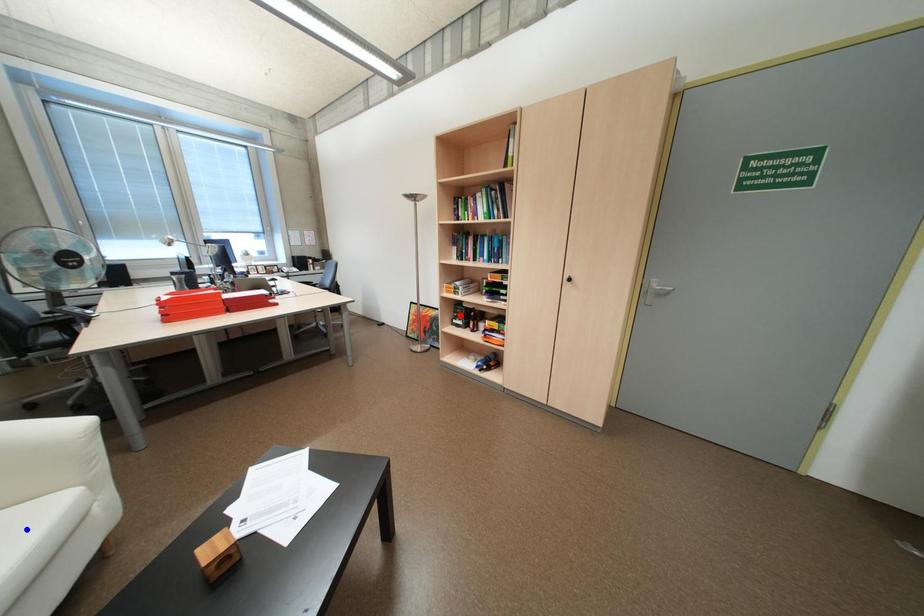
Question: In the image, two points are highlighted. Which point is nearer to the camera? Reply with the corresponding letter.

Choices:
 (A) blue point
 (B) red point

Answer: (A)